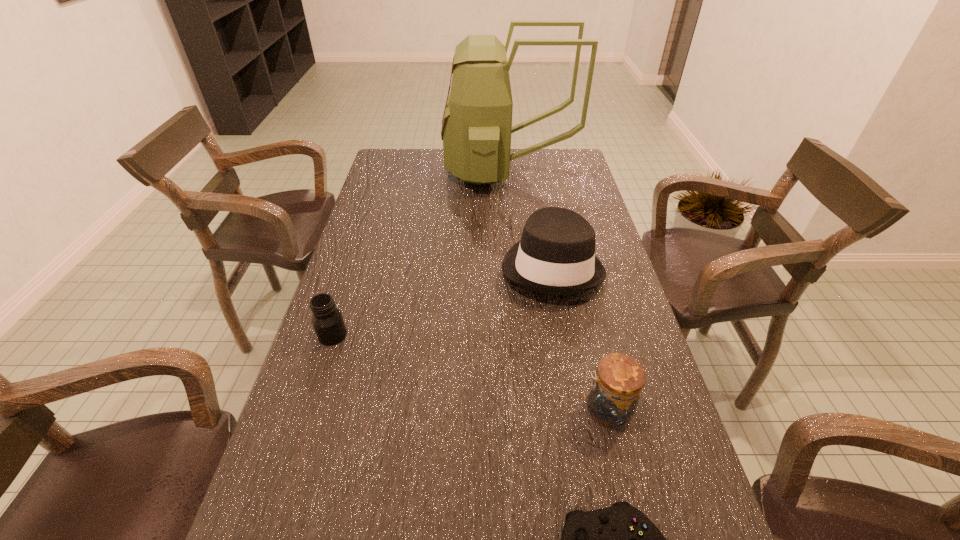
Where is `vacant position located 0.050m on the front pocket of the tallest object`? This screenshot has height=540, width=960. vacant position located 0.050m on the front pocket of the tallest object is located at coordinates (432, 171).

Locate an element on the screen. The image size is (960, 540). vacant point located on the front of the fourth nearest object is located at coordinates (576, 400).

Locate an element on the screen. Image resolution: width=960 pixels, height=540 pixels. vacant area located on the lid of the nearer jar is located at coordinates (436, 409).

Find the location of a particular element. blank space located on the lid of the nearer jar is located at coordinates pos(557,409).

This screenshot has height=540, width=960. Identify the location of vacant region located 0.060m on the lid of the nearer jar. (553, 409).

Image resolution: width=960 pixels, height=540 pixels. Find the location of `vacant space located 0.140m on the front of the left jar`. vacant space located 0.140m on the front of the left jar is located at coordinates (313, 396).

This screenshot has width=960, height=540. I want to click on object present at the far edge, so pyautogui.click(x=476, y=130).

You are a GUI agent. You are given a task and a screenshot of the screen. Output one action in this format:
    pyautogui.click(x=<x>, y=<y>)
    Task: Click on the object that is at the left edge
    
    Given the screenshot: What is the action you would take?
    pyautogui.click(x=327, y=320)

Find the location of a particular element. Image resolution: width=960 pixels, height=540 pixels. backpack that is at the right edge is located at coordinates (476, 130).

This screenshot has width=960, height=540. What are the coordinates of `fedora situated at the right edge` in the screenshot? It's located at (556, 254).